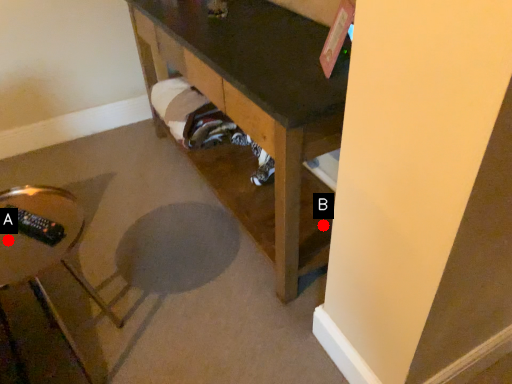
Question: Two points are circled on the image, labeled by A and B beside each circle. Which point appears farthest from the camera in this image?

Choices:
 (A) A is further
 (B) B is further

Answer: (B)